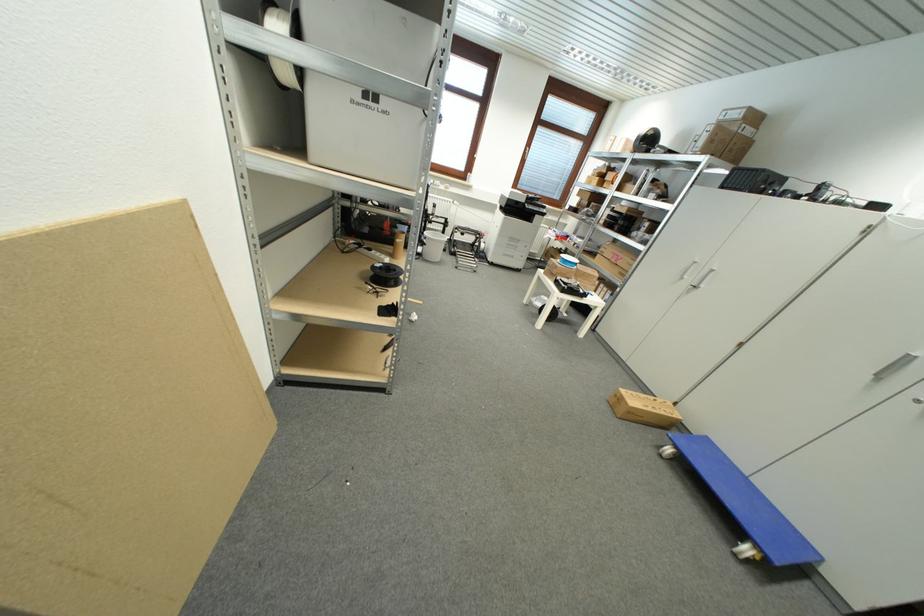
Identify the location of white bucket. The height and width of the screenshot is (616, 924). (432, 246).